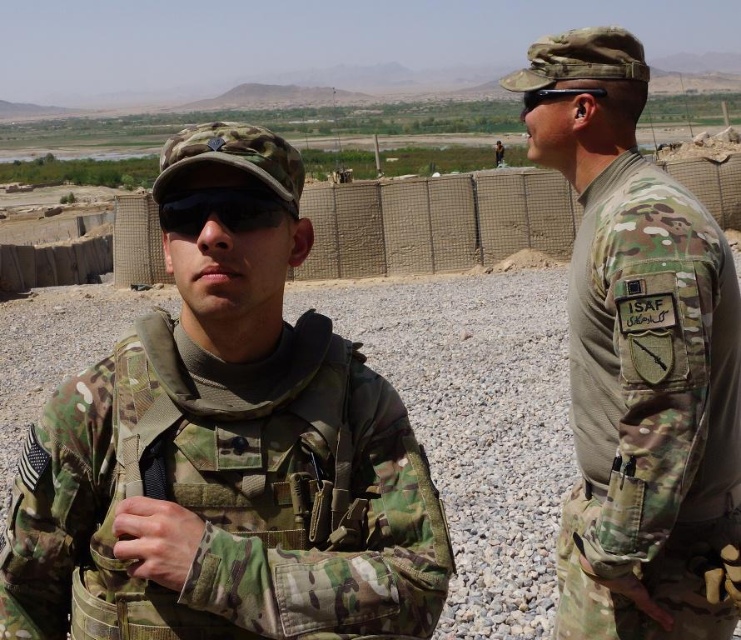
Is camo uniform at center positioned in front of camouflage uniform at right?

Yes, it is.

Which is above, camo uniform at center or camouflage uniform at right?

camouflage uniform at right is higher up.

Locate an element on the screen. The height and width of the screenshot is (640, 741). camo uniform at center is located at coordinates (225, 456).

Who is positioned more to the right, camouflage uniform at right or black matte goggles at center?

Positioned to the right is camouflage uniform at right.

Does camouflage uniform at right appear on the left side of black matte goggles at center?

In fact, camouflage uniform at right is to the right of black matte goggles at center.

Describe the element at coordinates (637, 362) in the screenshot. The image size is (741, 640). I see `camouflage uniform at right` at that location.

I want to click on camouflage uniform at right, so click(x=637, y=362).

Is camouflage uniform at right closer to camera compared to camouflage uniform at center?

Yes, camouflage uniform at right is in front of camouflage uniform at center.

Is point (722, 451) farther from camera compared to point (499, 160)?

No, (722, 451) is closer to viewer.

I want to click on camouflage uniform at right, so click(637, 362).